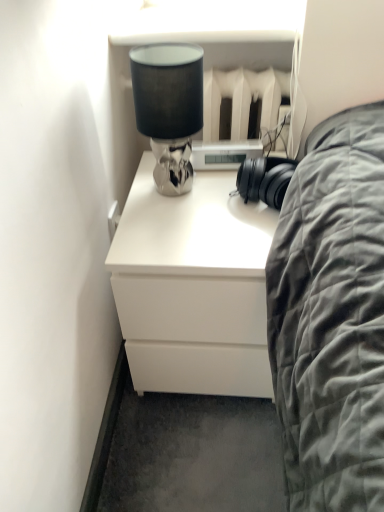
Locate an element on the screen. The width and height of the screenshot is (384, 512). white matte chest of drawers at center is located at coordinates [193, 287].

This screenshot has width=384, height=512. Describe the element at coordinates (193, 287) in the screenshot. I see `white matte chest of drawers at center` at that location.

This screenshot has width=384, height=512. Find the location of `satin silver lamp at upper center`. satin silver lamp at upper center is located at coordinates (169, 108).

What do you see at coordinates (169, 108) in the screenshot? I see `satin silver lamp at upper center` at bounding box center [169, 108].

The width and height of the screenshot is (384, 512). What are the coordinates of `white matte chest of drawers at center` in the screenshot? It's located at (193, 287).

Which is more to the left, satin silver lamp at upper center or white matte chest of drawers at center?

From the viewer's perspective, satin silver lamp at upper center appears more on the left side.

Is the position of satin silver lamp at upper center less distant than that of white matte chest of drawers at center?

Yes, satin silver lamp at upper center is closer to the camera.

Based on the photo, which is less distant, (174, 181) or (138, 240)?

Point (174, 181) is positioned farther from the camera compared to point (138, 240).

From the image's perspective, is satin silver lamp at upper center positioned above or below white matte chest of drawers at center?

satin silver lamp at upper center is above white matte chest of drawers at center.

From a real-world perspective, does satin silver lamp at upper center sit lower than white matte chest of drawers at center?

Actually, satin silver lamp at upper center is physically above white matte chest of drawers at center in the real world.

In terms of width, does satin silver lamp at upper center look wider or thinner when compared to white matte chest of drawers at center?

satin silver lamp at upper center is thinner than white matte chest of drawers at center.

Considering the sizes of objects satin silver lamp at upper center and white matte chest of drawers at center in the image provided, who is shorter, satin silver lamp at upper center or white matte chest of drawers at center?

Standing shorter between the two is satin silver lamp at upper center.

Based on their sizes in the image, would you say satin silver lamp at upper center is bigger or smaller than white matte chest of drawers at center?

In the image, satin silver lamp at upper center appears to be smaller than white matte chest of drawers at center.

Would you say satin silver lamp at upper center contains white matte chest of drawers at center?

No, white matte chest of drawers at center is located outside of satin silver lamp at upper center.

Is satin silver lamp at upper center next to white matte chest of drawers at center and touching it?

No, satin silver lamp at upper center is not with white matte chest of drawers at center.

Is satin silver lamp at upper center turned away from white matte chest of drawers at center?

satin silver lamp at upper center is not turned away from white matte chest of drawers at center.

You are a GUI agent. You are given a task and a screenshot of the screen. Output one action in this format:
    pyautogui.click(x=<x>, y=<y>)
    Task: Click on the table lamp on the left of white matte chest of drawers at center
    This screenshot has width=384, height=512.
    Given the screenshot: What is the action you would take?
    pyautogui.click(x=169, y=108)

From the picture: Considering the positions of objects white matte chest of drawers at center and satin silver lamp at upper center in the image provided, who is more to the right, white matte chest of drawers at center or satin silver lamp at upper center?

white matte chest of drawers at center.

Between white matte chest of drawers at center and satin silver lamp at upper center, which one is positioned behind?

white matte chest of drawers at center is further from the camera.

Which is more distant, (211, 306) or (161, 144)?

Positioned behind is point (161, 144).

Based on the photo, from the image's perspective, is white matte chest of drawers at center below satin silver lamp at upper center?

Yes.

From a real-world perspective, between white matte chest of drawers at center and satin silver lamp at upper center, who is vertically higher?

From a 3D spatial view, satin silver lamp at upper center is above.

Is white matte chest of drawers at center thinner than satin silver lamp at upper center?

Incorrect, the width of white matte chest of drawers at center is not less than that of satin silver lamp at upper center.

Between white matte chest of drawers at center and satin silver lamp at upper center, which one has less height?

With less height is satin silver lamp at upper center.

Is white matte chest of drawers at center bigger or smaller than satin silver lamp at upper center?

white matte chest of drawers at center is bigger than satin silver lamp at upper center.

Choose the correct answer: Is white matte chest of drawers at center inside satin silver lamp at upper center or outside it?

white matte chest of drawers at center is spatially situated outside satin silver lamp at upper center.

Is white matte chest of drawers at center touching satin silver lamp at upper center?

No, white matte chest of drawers at center is not touching satin silver lamp at upper center.

Is white matte chest of drawers at center positioned with its back to satin silver lamp at upper center?

white matte chest of drawers at center does not have its back to satin silver lamp at upper center.

How far apart are white matte chest of drawers at center and satin silver lamp at upper center?

white matte chest of drawers at center is 9.68 inches from satin silver lamp at upper center.

This screenshot has width=384, height=512. I want to click on chest of drawers on the right of satin silver lamp at upper center, so click(x=193, y=287).

I want to click on table lamp positioned vertically above the white matte chest of drawers at center (from a real-world perspective), so click(169, 108).

Image resolution: width=384 pixels, height=512 pixels. I want to click on the chest of drawers that is below the satin silver lamp at upper center (from the image's perspective), so (x=193, y=287).